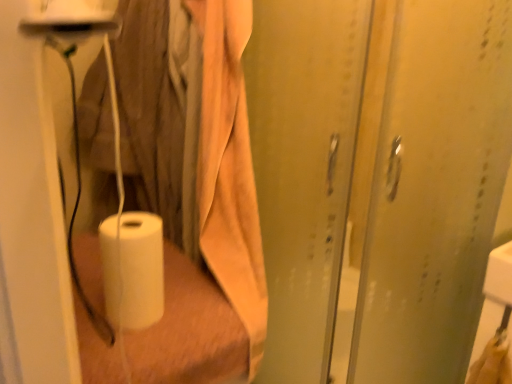
The height and width of the screenshot is (384, 512). What do you see at coordinates (304, 168) in the screenshot?
I see `translucent plastic screen door at center, positioned as the first screen door in left-to-right order` at bounding box center [304, 168].

The height and width of the screenshot is (384, 512). In order to click on translucent plastic screen door at center, arranged as the second screen door when viewed from the right in this screenshot , I will do `click(304, 168)`.

From the image's perspective, starting from the white matte paper towel at lower left, which screen door is the 1st one above? Please provide its 2D coordinates.

[(378, 177)]

Is the depth of white matte paper towel at lower left greater than that of transparent plastic screen door at right, which is the second screen door from left to right?

Yes, white matte paper towel at lower left is further from the viewer.

Does point (136, 272) come behind point (358, 356)?

No, (136, 272) is in front of (358, 356).

From their relative heights in the image, would you say white matte paper towel at lower left is taller or shorter than transparent plastic screen door at right, which is the second screen door from left to right?

Considering their sizes, white matte paper towel at lower left has less height than transparent plastic screen door at right, which is the second screen door from left to right.

Is translucent plastic screen door at center, positioned as the first screen door in left-to-right order, oriented towards transparent plastic screen door at right, which is the second screen door from left to right?

No, translucent plastic screen door at center, positioned as the first screen door in left-to-right order, is not turned towards transparent plastic screen door at right, which is the second screen door from left to right.

Can you confirm if translucent plastic screen door at center, positioned as the first screen door in left-to-right order, is shorter than transparent plastic screen door at right, which is the second screen door from left to right?

Yes, translucent plastic screen door at center, positioned as the first screen door in left-to-right order, is shorter than transparent plastic screen door at right, which is the second screen door from left to right.

From a real-world perspective, is translucent plastic screen door at center, positioned as the first screen door in left-to-right order, positioned over transparent plastic screen door at right, which is the second screen door from left to right, based on gravity?

Yes, from a real-world perspective, translucent plastic screen door at center, positioned as the first screen door in left-to-right order, is over transparent plastic screen door at right, which is the second screen door from left to right

Considering the sizes of translucent plastic screen door at center, arranged as the second screen door when viewed from the right, and transparent plastic screen door at right, acting as the 1th screen door starting from the right, in the image, is translucent plastic screen door at center, arranged as the second screen door when viewed from the right, bigger or smaller than transparent plastic screen door at right, acting as the 1th screen door starting from the right,?

In the image, translucent plastic screen door at center, arranged as the second screen door when viewed from the right, appears to be smaller than transparent plastic screen door at right, acting as the 1th screen door starting from the right.

Is transparent plastic screen door at right, acting as the 1th screen door starting from the right, oriented away from white matte paper towel at lower left?

transparent plastic screen door at right, acting as the 1th screen door starting from the right, is not turned away from white matte paper towel at lower left.

Who is shorter, transparent plastic screen door at right, which is the second screen door from left to right, or white matte paper towel at lower left?

white matte paper towel at lower left.

Who is more distant, transparent plastic screen door at right, which is the second screen door from left to right, or white matte paper towel at lower left?

Positioned behind is white matte paper towel at lower left.

Considering the sizes of transparent plastic screen door at right, which is the second screen door from left to right, and white matte paper towel at lower left in the image, is transparent plastic screen door at right, which is the second screen door from left to right, bigger or smaller than white matte paper towel at lower left?

transparent plastic screen door at right, which is the second screen door from left to right, is bigger than white matte paper towel at lower left.

Between white matte paper towel at lower left and translucent plastic screen door at center, positioned as the first screen door in left-to-right order, which one has larger size?

Bigger between the two is translucent plastic screen door at center, positioned as the first screen door in left-to-right order.

From a real-world perspective, is white matte paper towel at lower left on top of translucent plastic screen door at center, arranged as the second screen door when viewed from the right?

No, from a real-world perspective, white matte paper towel at lower left is not on top of translucent plastic screen door at center, arranged as the second screen door when viewed from the right.

Is white matte paper towel at lower left closer to camera compared to translucent plastic screen door at center, positioned as the first screen door in left-to-right order?

No.

The width and height of the screenshot is (512, 384). I want to click on paper towel on the left of translucent plastic screen door at center, arranged as the second screen door when viewed from the right, so click(x=133, y=269).

Considering the positions of objects translucent plastic screen door at center, positioned as the first screen door in left-to-right order, and white matte paper towel at lower left in the image provided, who is more to the right, translucent plastic screen door at center, positioned as the first screen door in left-to-right order, or white matte paper towel at lower left?

Positioned to the right is translucent plastic screen door at center, positioned as the first screen door in left-to-right order.

Between translucent plastic screen door at center, positioned as the first screen door in left-to-right order, and white matte paper towel at lower left, which one has smaller size?

white matte paper towel at lower left.

Can you confirm if translucent plastic screen door at center, arranged as the second screen door when viewed from the right, is thinner than white matte paper towel at lower left?

No, translucent plastic screen door at center, arranged as the second screen door when viewed from the right, is not thinner than white matte paper towel at lower left.

Would you consider transparent plastic screen door at right, acting as the 1th screen door starting from the right, to be distant from translucent plastic screen door at center, arranged as the second screen door when viewed from the right?

No, transparent plastic screen door at right, acting as the 1th screen door starting from the right, is in close proximity to translucent plastic screen door at center, arranged as the second screen door when viewed from the right.

From a real-world perspective, relative to translucent plastic screen door at center, arranged as the second screen door when viewed from the right, is transparent plastic screen door at right, acting as the 1th screen door starting from the right, vertically above or below?

transparent plastic screen door at right, acting as the 1th screen door starting from the right, is below translucent plastic screen door at center, arranged as the second screen door when viewed from the right.

From the image's perspective, is transparent plastic screen door at right, which is the second screen door from left to right, under translucent plastic screen door at center, arranged as the second screen door when viewed from the right?

Indeed, from the image's perspective, transparent plastic screen door at right, which is the second screen door from left to right, is shown beneath translucent plastic screen door at center, arranged as the second screen door when viewed from the right.

Is transparent plastic screen door at right, acting as the 1th screen door starting from the right, wider or thinner than translucent plastic screen door at center, arranged as the second screen door when viewed from the right?

transparent plastic screen door at right, acting as the 1th screen door starting from the right, is thinner than translucent plastic screen door at center, arranged as the second screen door when viewed from the right.

I want to click on paper towel that appears below the transparent plastic screen door at right, which is the second screen door from left to right (from the image's perspective), so click(133, 269).

Where is `screen door that is under the translucent plastic screen door at center, arranged as the second screen door when viewed from the right (from a real-world perspective)`? This screenshot has width=512, height=384. screen door that is under the translucent plastic screen door at center, arranged as the second screen door when viewed from the right (from a real-world perspective) is located at coordinates (378, 177).

Looking at the image, which one is located further to transparent plastic screen door at right, acting as the 1th screen door starting from the right, white matte paper towel at lower left or translucent plastic screen door at center, arranged as the second screen door when viewed from the right?

white matte paper towel at lower left is positioned further to the anchor transparent plastic screen door at right, acting as the 1th screen door starting from the right.

From the image, which object appears to be farther from white matte paper towel at lower left, translucent plastic screen door at center, arranged as the second screen door when viewed from the right, or transparent plastic screen door at right, acting as the 1th screen door starting from the right?

transparent plastic screen door at right, acting as the 1th screen door starting from the right, lies further to white matte paper towel at lower left than the other object.

Consider the image. Estimate the real-world distances between objects in this image. Which object is further from translucent plastic screen door at center, positioned as the first screen door in left-to-right order, transparent plastic screen door at right, acting as the 1th screen door starting from the right, or white matte paper towel at lower left?

white matte paper towel at lower left lies further to translucent plastic screen door at center, positioned as the first screen door in left-to-right order, than the other object.

When comparing their distances from white matte paper towel at lower left, does transparent plastic screen door at right, acting as the 1th screen door starting from the right, or translucent plastic screen door at center, positioned as the first screen door in left-to-right order, seem closer?

translucent plastic screen door at center, positioned as the first screen door in left-to-right order, lies closer to white matte paper towel at lower left than the other object.

From the image, which object appears to be nearer to transparent plastic screen door at right, acting as the 1th screen door starting from the right, translucent plastic screen door at center, arranged as the second screen door when viewed from the right, or white matte paper towel at lower left?

Based on the image, translucent plastic screen door at center, arranged as the second screen door when viewed from the right, appears to be nearer to transparent plastic screen door at right, acting as the 1th screen door starting from the right.

When comparing their distances from translucent plastic screen door at center, arranged as the second screen door when viewed from the right, does white matte paper towel at lower left or transparent plastic screen door at right, acting as the 1th screen door starting from the right, seem closer?

transparent plastic screen door at right, acting as the 1th screen door starting from the right, is closer to translucent plastic screen door at center, arranged as the second screen door when viewed from the right.

Where is `screen door between white matte paper towel at lower left and transparent plastic screen door at right, which is the second screen door from left to right, from left to right`? The image size is (512, 384). screen door between white matte paper towel at lower left and transparent plastic screen door at right, which is the second screen door from left to right, from left to right is located at coordinates (304, 168).